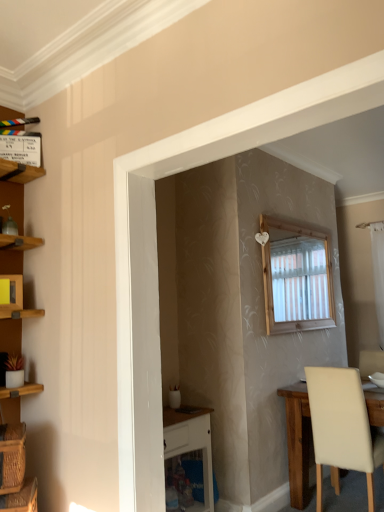
Question: From the image's perspective, is beige leather chair at lower right below yellow matte cabinet at upper left, positioned as the first cabinet in bottom-to-top order?

Choices:
 (A) yes
 (B) no

Answer: (A)

Question: Can you confirm if beige leather chair at lower right is positioned to the right of yellow matte cabinet at upper left, which appears as the second cabinet when viewed from the top?

Choices:
 (A) no
 (B) yes

Answer: (B)

Question: Is beige leather chair at lower right closer to camera compared to yellow matte cabinet at upper left, arranged as the second cabinet when viewed from the back?

Choices:
 (A) yes
 (B) no

Answer: (B)

Question: Is beige leather chair at lower right further to camera compared to yellow matte cabinet at upper left, arranged as the 1th cabinet when viewed from the front?

Choices:
 (A) yes
 (B) no

Answer: (A)

Question: From a real-world perspective, is beige leather chair at lower right on top of yellow matte cabinet at upper left, which appears as the second cabinet when viewed from the top?

Choices:
 (A) yes
 (B) no

Answer: (B)

Question: Is wooden clapperboard at upper left, the 1th cabinet viewed from the back, taller or shorter than white glossy vanity at lower center?

Choices:
 (A) tall
 (B) short

Answer: (B)

Question: From the image's perspective, is wooden clapperboard at upper left, the 1th cabinet viewed from the back, positioned above or below white glossy vanity at lower center?

Choices:
 (A) above
 (B) below

Answer: (A)

Question: In terms of size, does wooden clapperboard at upper left, the 1th cabinet viewed from the back, appear bigger or smaller than white glossy vanity at lower center?

Choices:
 (A) big
 (B) small

Answer: (B)

Question: In the image, is wooden clapperboard at upper left, the first cabinet when ordered from top to bottom, on the left side or the right side of white glossy vanity at lower center?

Choices:
 (A) right
 (B) left

Answer: (B)

Question: Based on their sizes in the image, would you say white sheer curtain at right is bigger or smaller than woven brown basket at lower left, the first basket positioned from the bottom?

Choices:
 (A) small
 (B) big

Answer: (B)

Question: Relative to woven brown basket at lower left, the first basket positioned from the bottom, is white sheer curtain at right in front or behind?

Choices:
 (A) behind
 (B) front

Answer: (A)

Question: Choose the correct answer: Is white sheer curtain at right inside woven brown basket at lower left, the first basket positioned from the bottom, or outside it?

Choices:
 (A) outside
 (B) inside

Answer: (A)

Question: From the image's perspective, is white sheer curtain at right located above or below woven brown basket at lower left, the second basket positioned from the top?

Choices:
 (A) above
 (B) below

Answer: (A)

Question: Considering the positions of white sheer curtain at right and woven brown basket at lower left, the 1th basket in the top-to-bottom sequence, in the image, is white sheer curtain at right bigger or smaller than woven brown basket at lower left, the 1th basket in the top-to-bottom sequence,?

Choices:
 (A) big
 (B) small

Answer: (A)

Question: From their relative heights in the image, would you say white sheer curtain at right is taller or shorter than woven brown basket at lower left, the 1th basket in the top-to-bottom sequence?

Choices:
 (A) tall
 (B) short

Answer: (A)